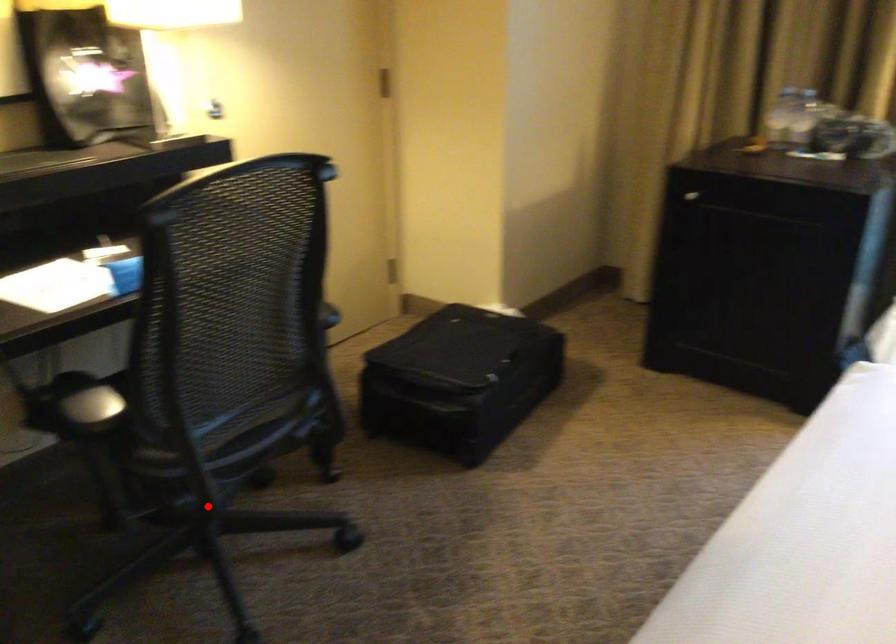
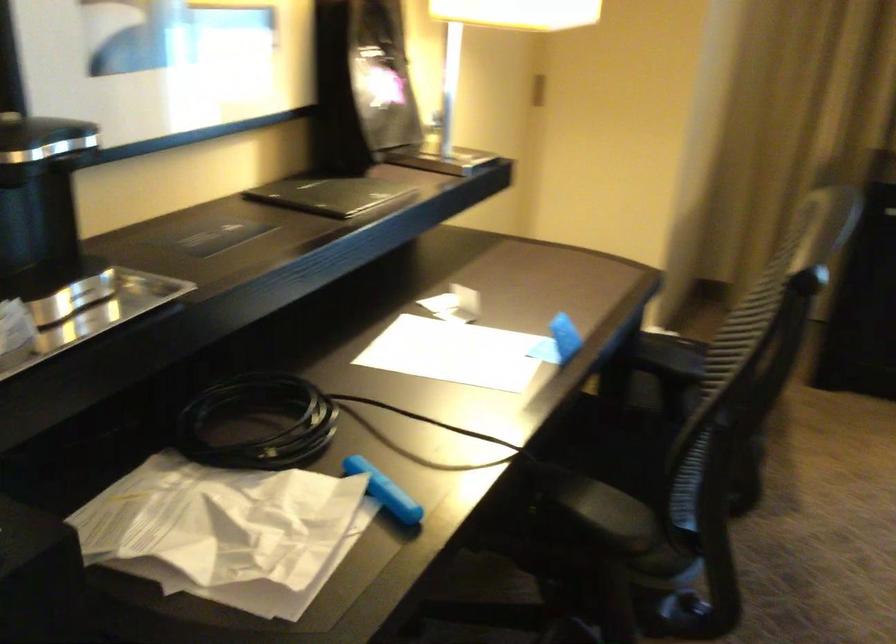
In the second image, find the point that corresponds to the highlighted location in the first image.

(679, 614)